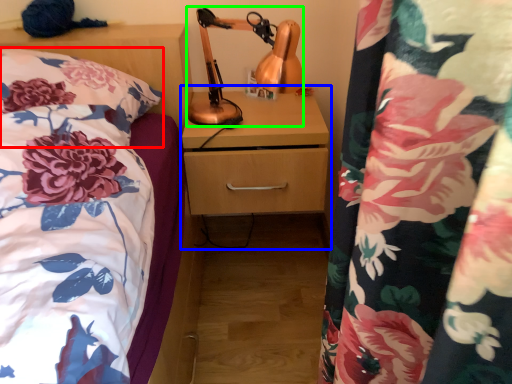
Question: Which object is positioned farthest from pillow (highlighted by a red box)? Select from dresser (highlighted by a blue box) and table lamp (highlighted by a green box).

Choices:
 (A) dresser
 (B) table lamp

Answer: (A)